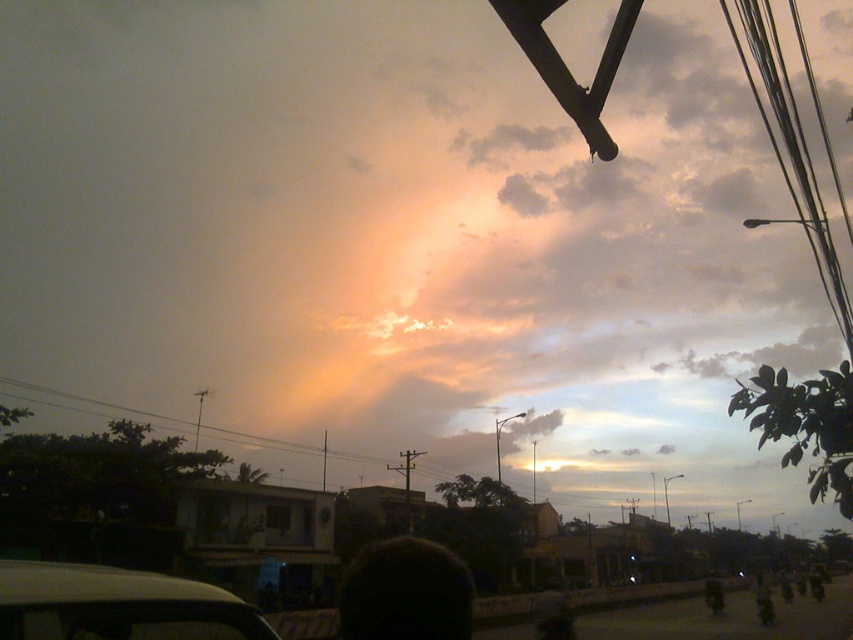
Question: Can you confirm if white matte car at lower left is bigger than metallic wires at upper right?

Choices:
 (A) yes
 (B) no

Answer: (B)

Question: Considering the relative positions of white matte car at lower left and metallic wires at upper right in the image provided, where is white matte car at lower left located with respect to metallic wires at upper right?

Choices:
 (A) left
 (B) right

Answer: (A)

Question: Is white matte car at lower left wider than metallic wires at upper right?

Choices:
 (A) yes
 (B) no

Answer: (B)

Question: Which object is farther from the camera taking this photo?

Choices:
 (A) white matte car at lower left
 (B) metallic wires at upper right

Answer: (B)